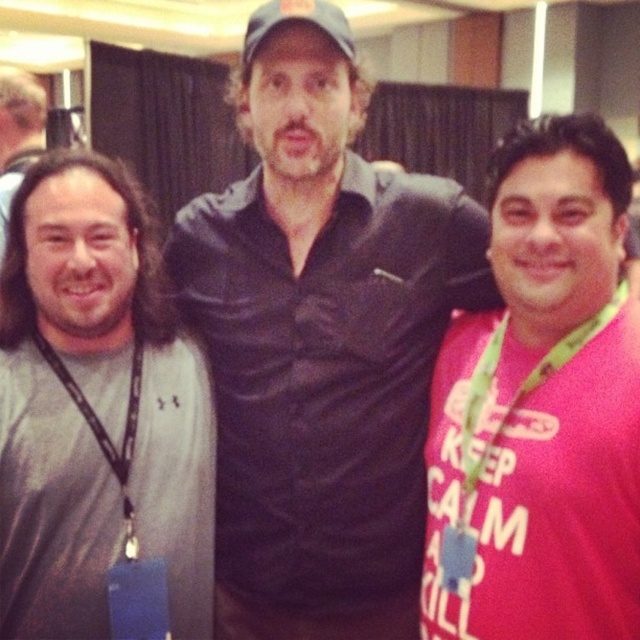
Question: Does green fabric lanyard at right have a greater width compared to gray fabric baseball cap at center?

Choices:
 (A) yes
 (B) no

Answer: (A)

Question: Considering the relative positions of green fabric lanyard at right and black lanyard at left in the image provided, where is green fabric lanyard at right located with respect to black lanyard at left?

Choices:
 (A) below
 (B) above

Answer: (B)

Question: Is green fabric lanyard at right bigger than black lanyard at left?

Choices:
 (A) yes
 (B) no

Answer: (A)

Question: Which is farther from the black lanyard at left?

Choices:
 (A) green fabric lanyard at right
 (B) gray fabric baseball cap at center

Answer: (B)

Question: Which object is farther from the camera taking this photo?

Choices:
 (A) green fabric lanyard at right
 (B) black lanyard at left
 (C) gray fabric baseball cap at center

Answer: (B)

Question: Which point is farther to the camera?

Choices:
 (A) gray fabric baseball cap at center
 (B) black lanyard at left
 (C) green fabric lanyard at right

Answer: (B)